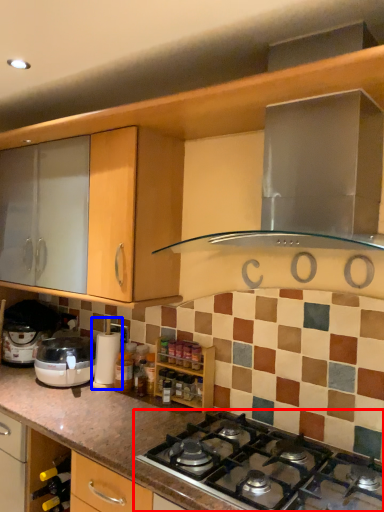
Question: Which of the following is the closest to the observer, gas stove (highlighted by a red box) or coffee machine (highlighted by a blue box)?

Choices:
 (A) gas stove
 (B) coffee machine

Answer: (A)